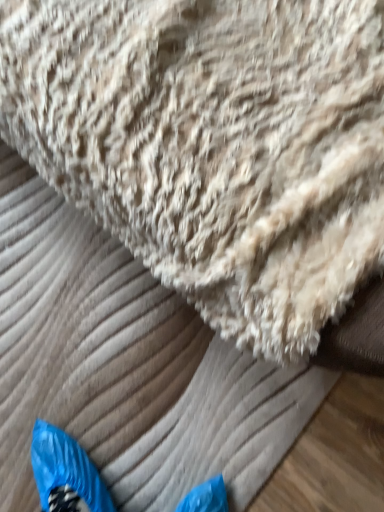
Question: From the image's perspective, is beige fluffy towel at upper center positioned above or below beige fluffy blanket at upper center?

Choices:
 (A) below
 (B) above

Answer: (B)

Question: Looking at their shapes, would you say beige fluffy towel at upper center is wider or thinner than beige fluffy blanket at upper center?

Choices:
 (A) thin
 (B) wide

Answer: (A)

Question: In the image, is beige fluffy towel at upper center positioned in front of or behind beige fluffy blanket at upper center?

Choices:
 (A) front
 (B) behind

Answer: (A)

Question: Looking at their shapes, would you say beige fluffy blanket at upper center is wider or thinner than beige fluffy towel at upper center?

Choices:
 (A) thin
 (B) wide

Answer: (B)

Question: In the image, is beige fluffy blanket at upper center positioned in front of or behind beige fluffy towel at upper center?

Choices:
 (A) behind
 (B) front

Answer: (A)

Question: Is point (59, 326) closer or farther from the camera than point (49, 8)?

Choices:
 (A) closer
 (B) farther

Answer: (B)

Question: Considering the relative positions of beige fluffy blanket at upper center and beige fluffy towel at upper center in the image provided, is beige fluffy blanket at upper center to the left or to the right of beige fluffy towel at upper center?

Choices:
 (A) left
 (B) right

Answer: (A)